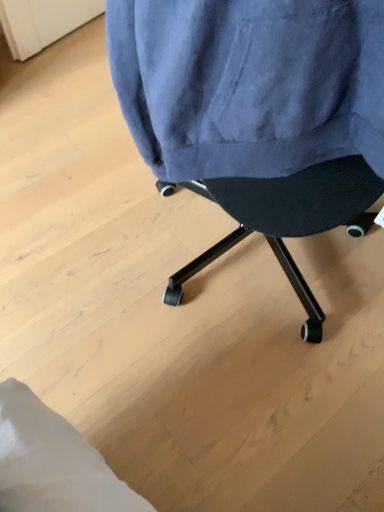
This screenshot has height=512, width=384. I want to click on vacant space in suede-like blue chair at center (from a real-world perspective), so click(x=228, y=259).